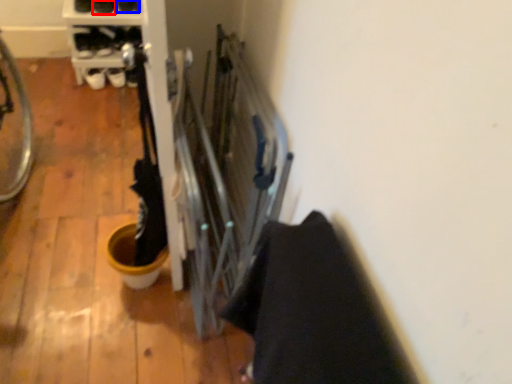
Question: Which of the following is the closest to the observer, footwear (highlighted by a red box) or footwear (highlighted by a blue box)?

Choices:
 (A) footwear
 (B) footwear

Answer: (A)